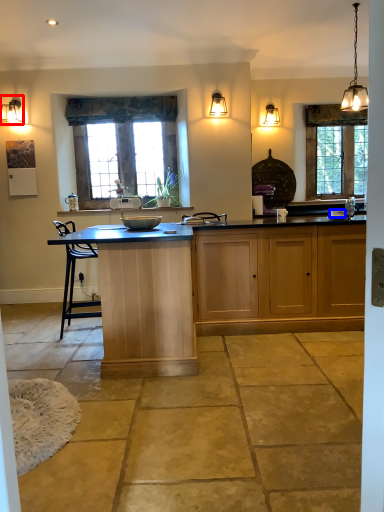
Question: Which object is closer to the camera taking this photo, lamp (highlighted by a red box) or bowl (highlighted by a blue box)?

Choices:
 (A) lamp
 (B) bowl

Answer: (B)